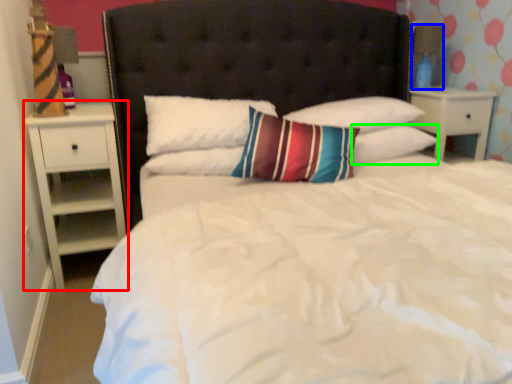
Question: Considering the real-world distances, which object is farthest from nightstand (highlighted by a red box)? lamp (highlighted by a blue box) or pillow (highlighted by a green box)?

Choices:
 (A) lamp
 (B) pillow

Answer: (A)